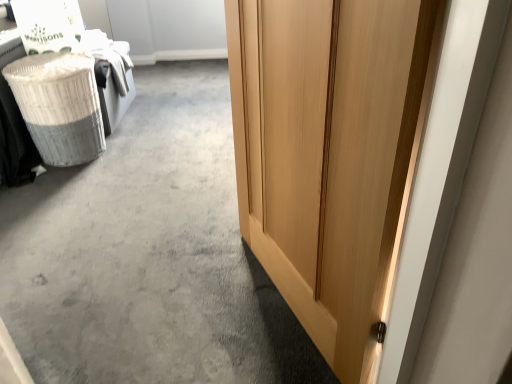
Question: From a real-world perspective, is white wicker laundry basket at left beneath light wood door at right?

Choices:
 (A) no
 (B) yes

Answer: (B)

Question: Does white wicker laundry basket at left turn towards light wood door at right?

Choices:
 (A) no
 (B) yes

Answer: (A)

Question: Is white wicker laundry basket at left at the left side of light wood door at right?

Choices:
 (A) yes
 (B) no

Answer: (A)

Question: Is white wicker laundry basket at left touching light wood door at right?

Choices:
 (A) yes
 (B) no

Answer: (B)

Question: Considering the relative sizes of white wicker laundry basket at left and light wood door at right in the image provided, is white wicker laundry basket at left bigger than light wood door at right?

Choices:
 (A) yes
 (B) no

Answer: (B)

Question: Relative to wooden door at right, is white wicker laundry basket at left in front or behind?

Choices:
 (A) front
 (B) behind

Answer: (B)

Question: Is white wicker laundry basket at left inside the boundaries of wooden door at right, or outside?

Choices:
 (A) outside
 (B) inside

Answer: (A)

Question: In terms of size, does white wicker laundry basket at left appear bigger or smaller than wooden door at right?

Choices:
 (A) big
 (B) small

Answer: (B)

Question: Considering the positions of point (51, 135) and point (146, 150), is point (51, 135) closer or farther from the camera than point (146, 150)?

Choices:
 (A) farther
 (B) closer

Answer: (B)

Question: In the image, is light wood door at right positioned in front of or behind wooden door at right?

Choices:
 (A) front
 (B) behind

Answer: (A)

Question: From the image's perspective, is light wood door at right located above or below wooden door at right?

Choices:
 (A) below
 (B) above

Answer: (A)

Question: Looking at their shapes, would you say light wood door at right is wider or thinner than wooden door at right?

Choices:
 (A) wide
 (B) thin

Answer: (B)

Question: Is point (340, 299) positioned closer to the camera than point (194, 117)?

Choices:
 (A) farther
 (B) closer

Answer: (B)

Question: From their relative heights in the image, would you say wooden door at right is taller or shorter than white wicker laundry basket at left?

Choices:
 (A) tall
 (B) short

Answer: (B)

Question: Which is correct: wooden door at right is inside white wicker laundry basket at left, or outside of it?

Choices:
 (A) inside
 (B) outside

Answer: (B)